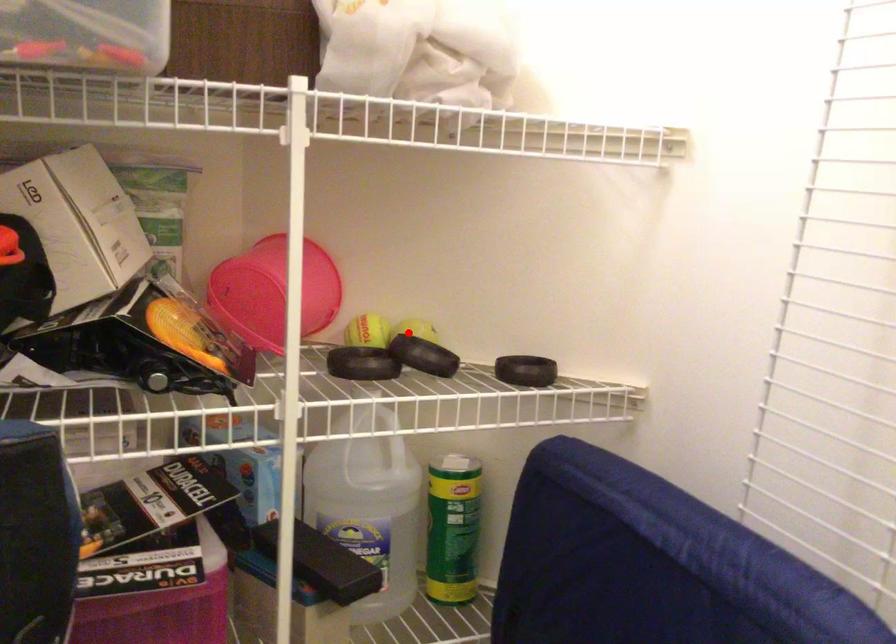
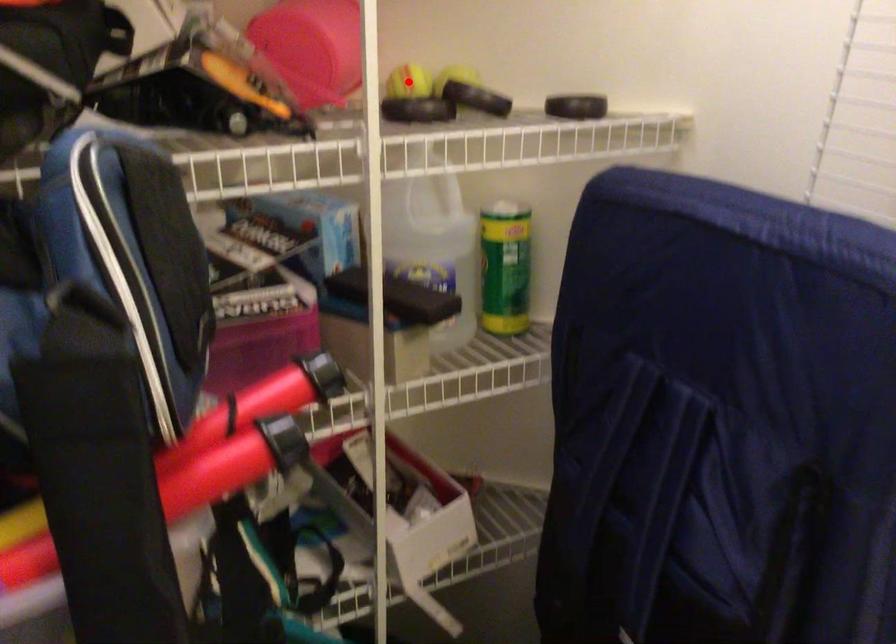
I am providing you with two images of the same scene from different viewpoints. A red point is marked on the first image and another point is marked on the second image. Is the marked point in image1 the same physical position as the marked point in image2?

No